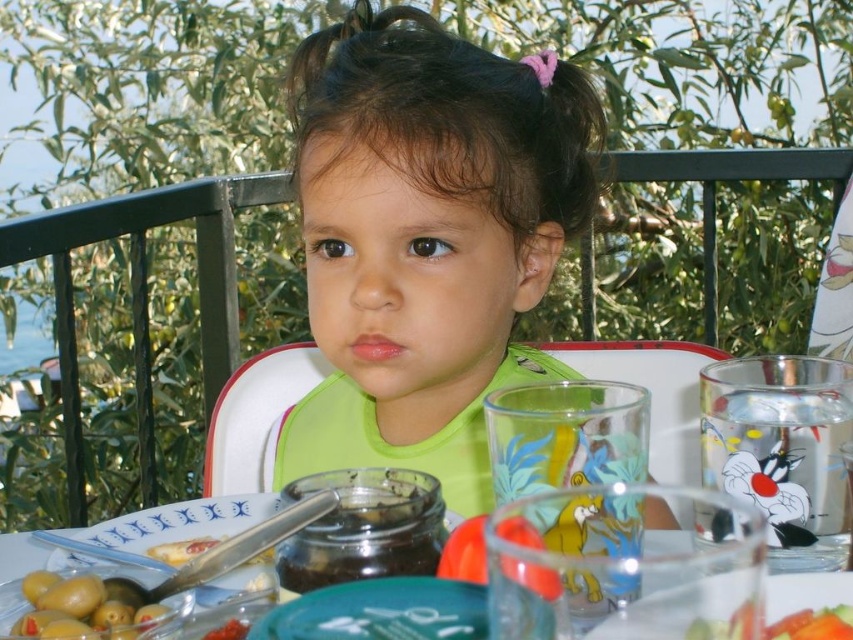
Question: Can you confirm if green olive at lower left is positioned to the right of smooth plastic cup at lower right?

Choices:
 (A) no
 (B) yes

Answer: (A)

Question: Considering the relative positions of green olive at lower left and smooth plastic cup at lower right in the image provided, where is green olive at lower left located with respect to smooth plastic cup at lower right?

Choices:
 (A) left
 (B) right

Answer: (A)

Question: Which object is farther from the camera taking this photo?

Choices:
 (A) green matte bib at center
 (B) yellow creamy spread at lower left
 (C) clear glass platter at lower right

Answer: (A)

Question: Which of these objects is positioned closest to the clear glass platter at lower right?

Choices:
 (A) green matte bib at center
 (B) yellow creamy spread at lower left

Answer: (B)

Question: Which of the following is the closest to the observer?

Choices:
 (A) smooth plastic cup at lower right
 (B) clear glass platter at lower right
 (C) translucent glass jar at center
 (D) yellow creamy spread at lower left

Answer: (A)

Question: Where is green matte bib at center located in relation to translucent glass jar at center in the image?

Choices:
 (A) right
 (B) left

Answer: (A)